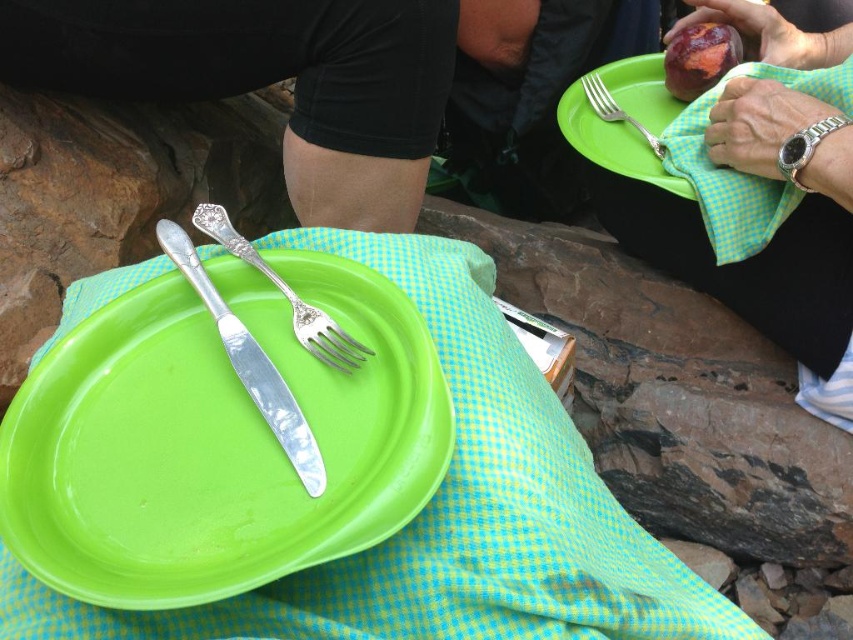
What are the coordinates of the matte silver fork at upper center in the image?

The matte silver fork at upper center is located at coordinates point (772, 236).

You are setting up a picnic and want to place a napkin on the green plastic plate at center. However, you notice the silver polished fork at center is blocking the plate. Can you place the napkin on the plate without moving the fork?

The green plastic plate at center is in front of the silver polished fork at center, so you can place the napkin on the plate without moving the fork since the plate is already positioned in front of the fork.

Consider the image. You are holding a 40 centimeter long ruler and want to measure the distance between yourself and the polished silver knife at center. Can you reach it without moving your hand?

The polished silver knife at center is 50.13 centimeters from viewer, which is beyond the 40 centimeter ruler, so you cannot reach it without moving your hand.